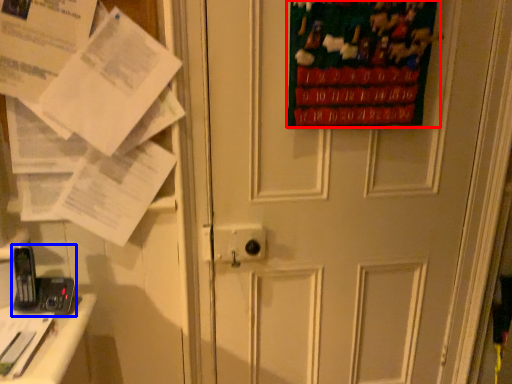
Question: Which of the following is the closest to the observer, poster page (highlighted by a red box) or equipment (highlighted by a blue box)?

Choices:
 (A) poster page
 (B) equipment

Answer: (A)